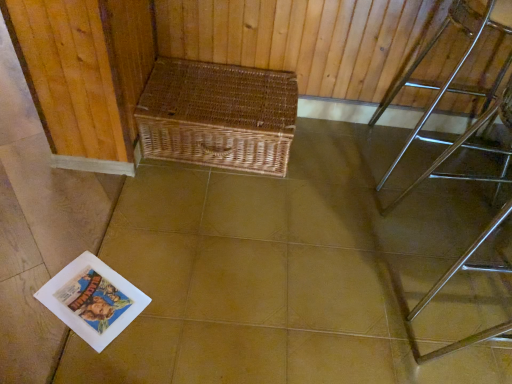
Identify the location of vacant space that is to the left of polished chrome table at right. (339, 167).